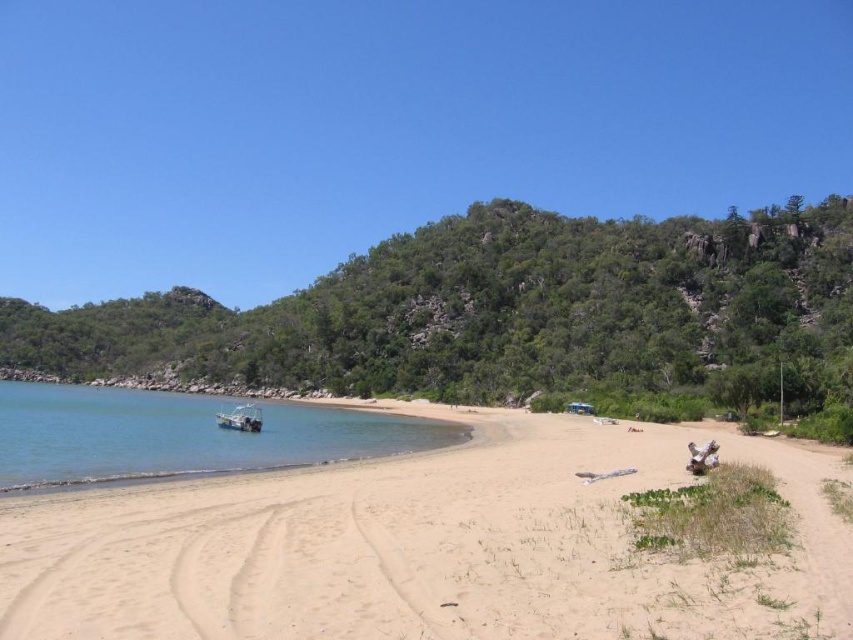
Can you confirm if light beige sand at lower center is taller than metallic silver boat at lower left?

No.

Can you confirm if light beige sand at lower center is positioned above metallic silver boat at lower left?

Indeed, light beige sand at lower center is positioned over metallic silver boat at lower left.

Identify the location of light beige sand at lower center. Image resolution: width=853 pixels, height=640 pixels. (421, 547).

Find the location of `light beige sand at lower center`. light beige sand at lower center is located at coordinates (421, 547).

Does light beige sand at lower center come behind clear water at lower left?

No.

Which is in front, point (405, 484) or point (323, 461)?

Point (405, 484)

The image size is (853, 640). Find the location of `light beige sand at lower center`. light beige sand at lower center is located at coordinates (421, 547).

Between clear water at lower left and metallic silver boat at lower left, which one appears on the left side from the viewer's perspective?

clear water at lower left

Between clear water at lower left and metallic silver boat at lower left, which one is positioned lower?

clear water at lower left is lower down.

The image size is (853, 640). Identify the location of clear water at lower left. (183, 435).

Image resolution: width=853 pixels, height=640 pixels. Identify the location of clear water at lower left. (183, 435).